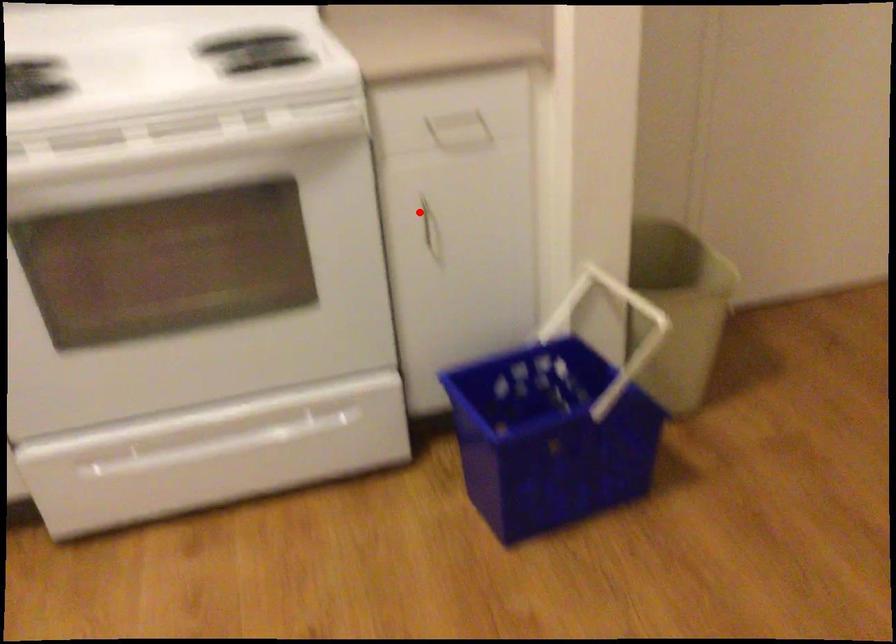
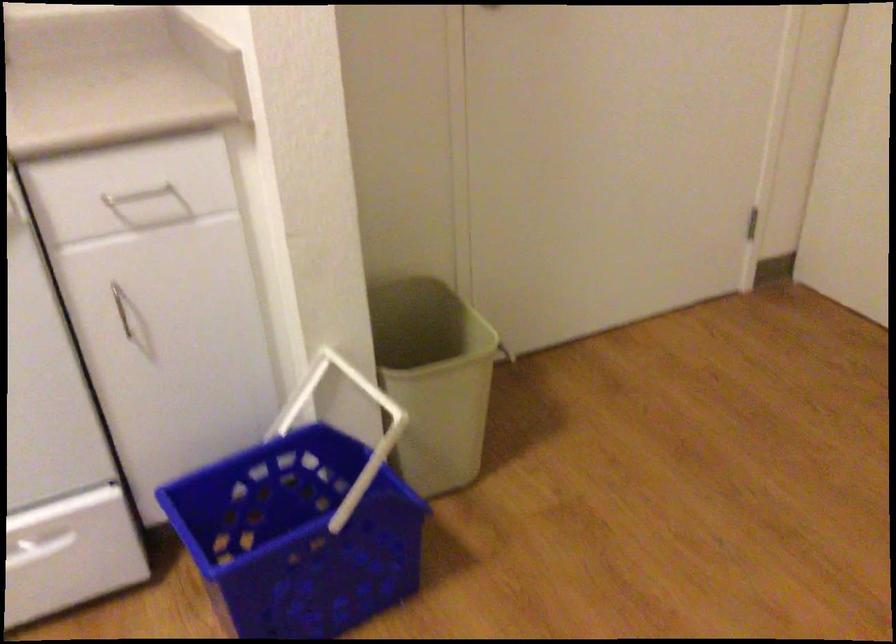
Where in the second image is the point corresponding to the highlighted location from the first image?

(121, 307)